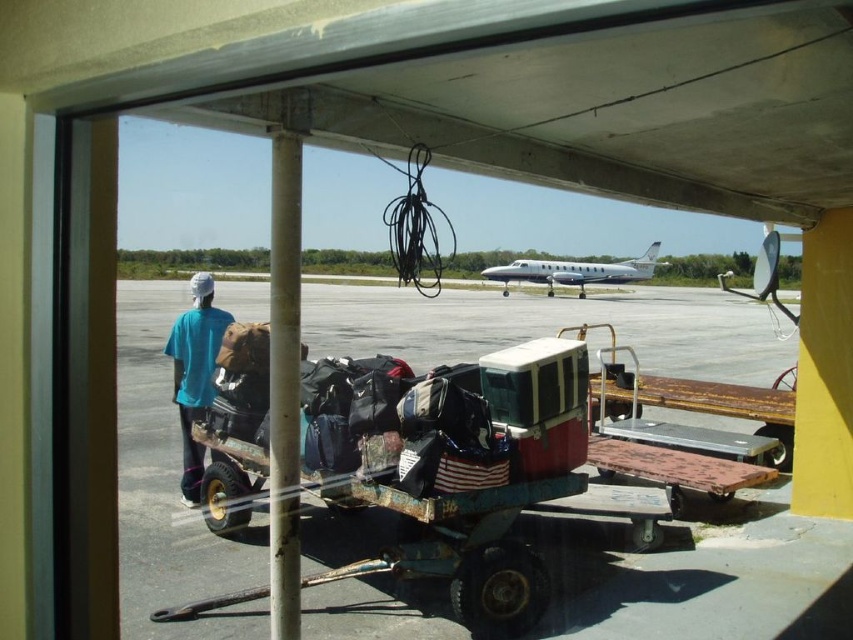
Does rusty metal cart at center have a smaller size compared to blue t-shirt at center?

Actually, rusty metal cart at center might be larger than blue t-shirt at center.

Is the position of rusty metal cart at center more distant than that of blue t-shirt at center?

No, rusty metal cart at center is closer to the viewer.

Is point (260, 378) behind point (201, 378)?

No, it is in front of (201, 378).

Find the location of a particular element. This screenshot has height=640, width=853. rusty metal cart at center is located at coordinates (486, 461).

Does rusty metal cart at center have a smaller size compared to white glossy airplane at center?

Yes, rusty metal cart at center is smaller than white glossy airplane at center.

Is point (225, 336) positioned after point (567, 269)?

No.

The width and height of the screenshot is (853, 640). In order to click on rusty metal cart at center in this screenshot , I will do `click(486, 461)`.

Who is more forward, (198,449) or (532,275)?

Point (198,449)

Between blue t-shirt at center and white glossy airplane at center, which one is positioned higher?

Positioned higher is white glossy airplane at center.

Find the location of a particular element. The image size is (853, 640). blue t-shirt at center is located at coordinates (194, 372).